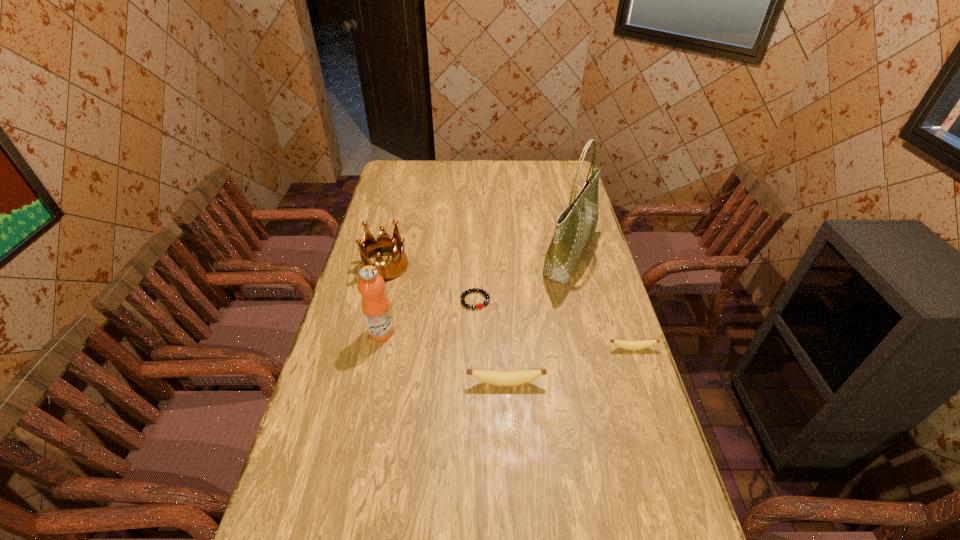
At what (x,y) coordinates should I click in order to perform the action: click on vacant point located on the back of the taller banana. Please return your answer as a coordinate pair (x, y). Image resolution: width=960 pixels, height=540 pixels. Looking at the image, I should click on (501, 296).

Find the location of `vacant space located on the back of the fifth farthest object`. vacant space located on the back of the fifth farthest object is located at coordinates (616, 298).

Find the location of a particular element. This screenshot has width=960, height=540. vacant space located on the right of the bracelet is located at coordinates pos(594,300).

The height and width of the screenshot is (540, 960). What are the coordinates of `free spot located 0.250m on the right of the crown` in the screenshot? It's located at (475, 266).

You are a GUI agent. You are given a task and a screenshot of the screen. Output one action in this format:
    pyautogui.click(x=<x>, y=<y>)
    Task: Click on the vacant space located on the left of the shopping bag
    This screenshot has height=540, width=960.
    Given the screenshot: What is the action you would take?
    pyautogui.click(x=520, y=256)

You are a GUI agent. You are given a task and a screenshot of the screen. Output one action in this format:
    pyautogui.click(x=<x>, y=<y>)
    Task: Click on the vacant area situated 0.280m on the front of the fifth shortest object
    
    Given the screenshot: What is the action you would take?
    point(362,423)

You are a GUI agent. You are given a task and a screenshot of the screen. Output one action in this format:
    pyautogui.click(x=<x>, y=<y>)
    Task: Click on the crown that is positioned at the left edge
    The height and width of the screenshot is (540, 960).
    Given the screenshot: What is the action you would take?
    pyautogui.click(x=368, y=247)

The width and height of the screenshot is (960, 540). In order to click on fruit juice at the left edge in this screenshot , I will do click(x=376, y=309).

Locate an element on the screen. This screenshot has height=540, width=960. banana positioned at the right edge is located at coordinates (626, 344).

Where is `shopping bag that is positioned at the right edge`? The height and width of the screenshot is (540, 960). shopping bag that is positioned at the right edge is located at coordinates coord(575,227).